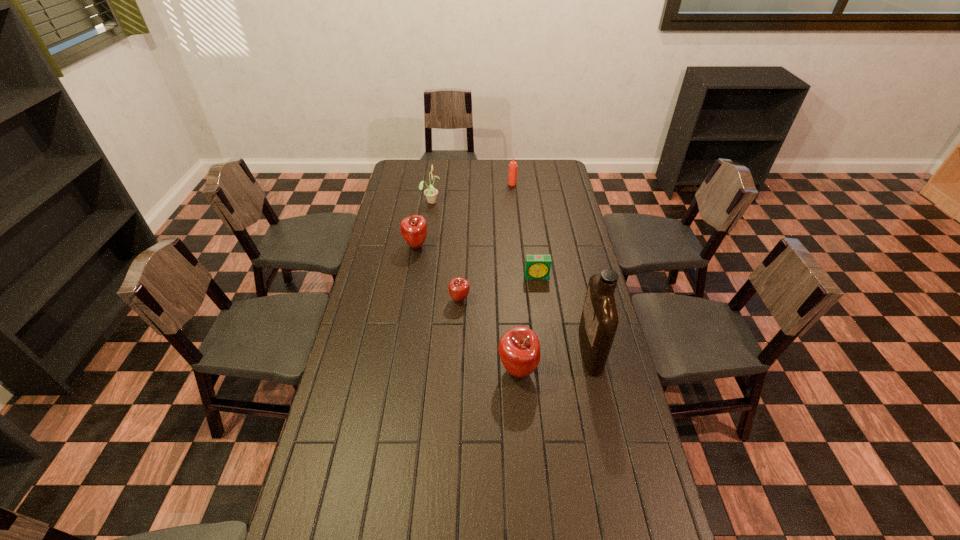
Please point a spot on the right to add another apple. Please provide its 2D coordinates. Your answer should be formatted as a tuple, i.e. [(x, y)], where the tuple contains the x and y coordinates of a point satisfying the conditions above.

[(598, 469)]